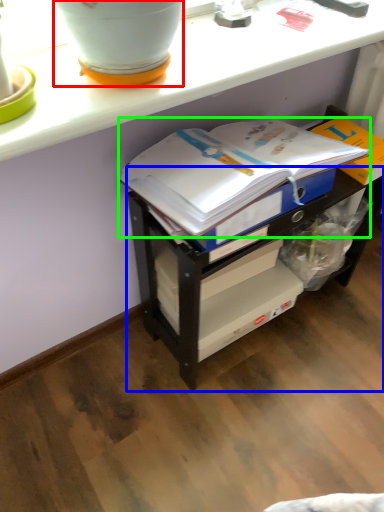
Question: Based on their relative distances, which object is nearer to flowerpot (highlighted by a red box)? Choose from shelf (highlighted by a blue box) and journal (highlighted by a green box).

Choices:
 (A) shelf
 (B) journal

Answer: (B)